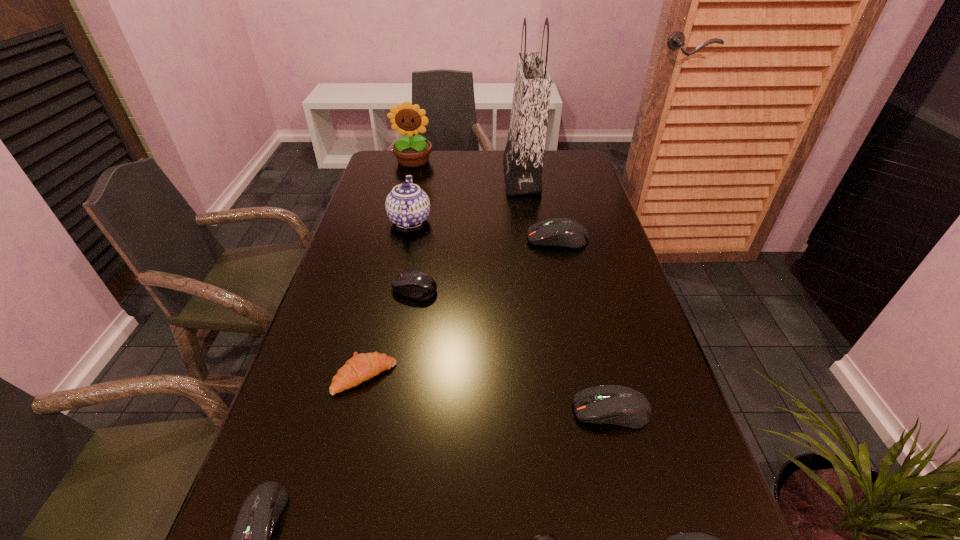
At what (x,y) coordinates should I click in order to perform the action: click on free space located 0.240m on the front of the farther black mouse. Please return your answer as a coordinate pair (x, y). Looking at the image, I should click on (399, 383).

Where is `vacant area situated 0.370m on the button of the second farthest dark computer equipment`? The height and width of the screenshot is (540, 960). vacant area situated 0.370m on the button of the second farthest dark computer equipment is located at coordinates (384, 410).

The width and height of the screenshot is (960, 540). I want to click on vacant space situated on the button of the second farthest dark computer equipment, so click(x=492, y=410).

This screenshot has width=960, height=540. Identify the location of vacant space located 0.050m on the button of the second farthest dark computer equipment. click(x=547, y=410).

Find the location of `vacant space located 0.130m on the right of the crescent roll`. vacant space located 0.130m on the right of the crescent roll is located at coordinates (457, 377).

Where is `shopping bag that is at the far edge`? This screenshot has height=540, width=960. shopping bag that is at the far edge is located at coordinates (523, 157).

The width and height of the screenshot is (960, 540). I want to click on sunflower present at the far edge, so click(x=411, y=152).

Locate an element on the screen. Image resolution: width=960 pixels, height=540 pixels. sunflower present at the left edge is located at coordinates (411, 152).

The height and width of the screenshot is (540, 960). What are the coordinates of `chinaware at the left edge` in the screenshot? It's located at (407, 206).

At what (x,y) coordinates should I click in order to perform the action: click on crescent roll that is at the left edge. Please return your answer as a coordinate pair (x, y). This screenshot has width=960, height=540. Looking at the image, I should click on (361, 367).